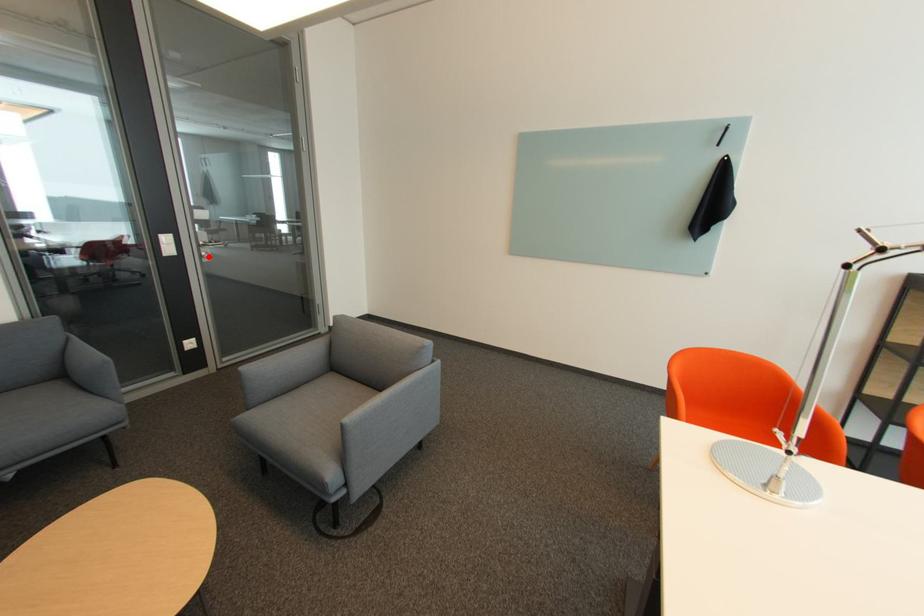
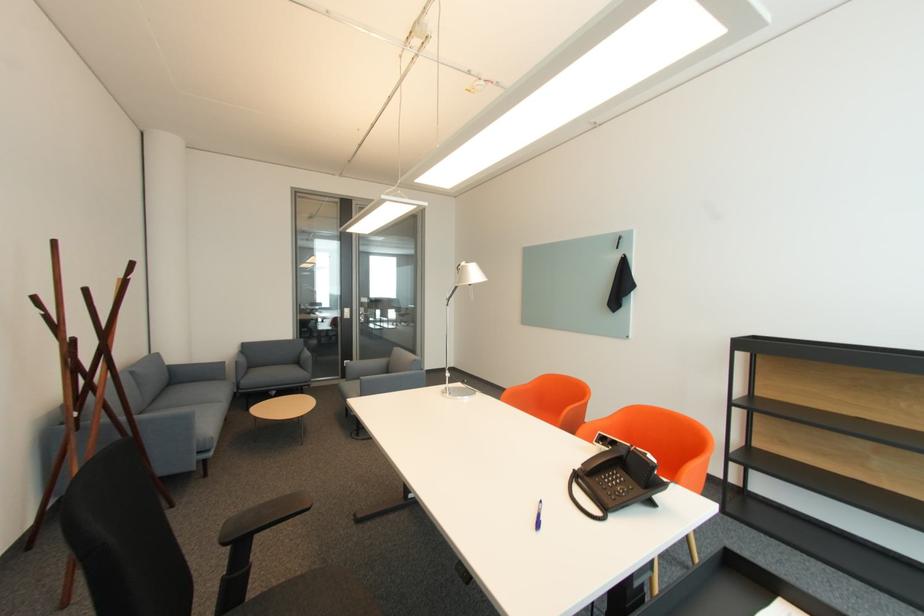
The point at the highlighted location is marked in the first image. Where is the corresponding point in the second image?

(367, 320)